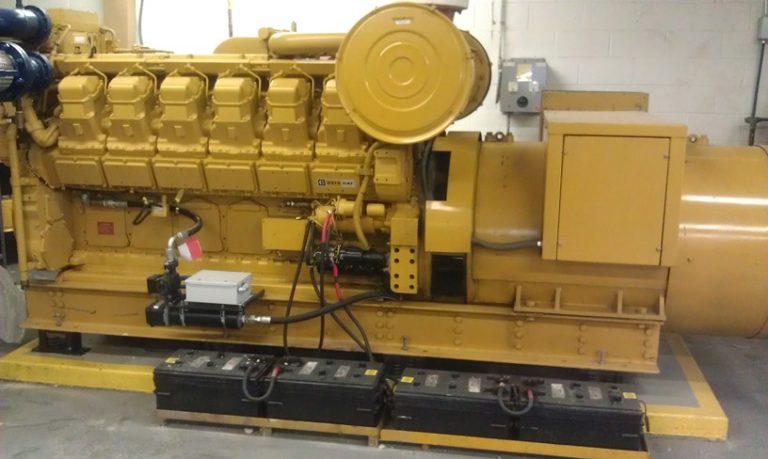
Find the location of `metal plug in to box`. metal plug in to box is located at coordinates (247, 323).